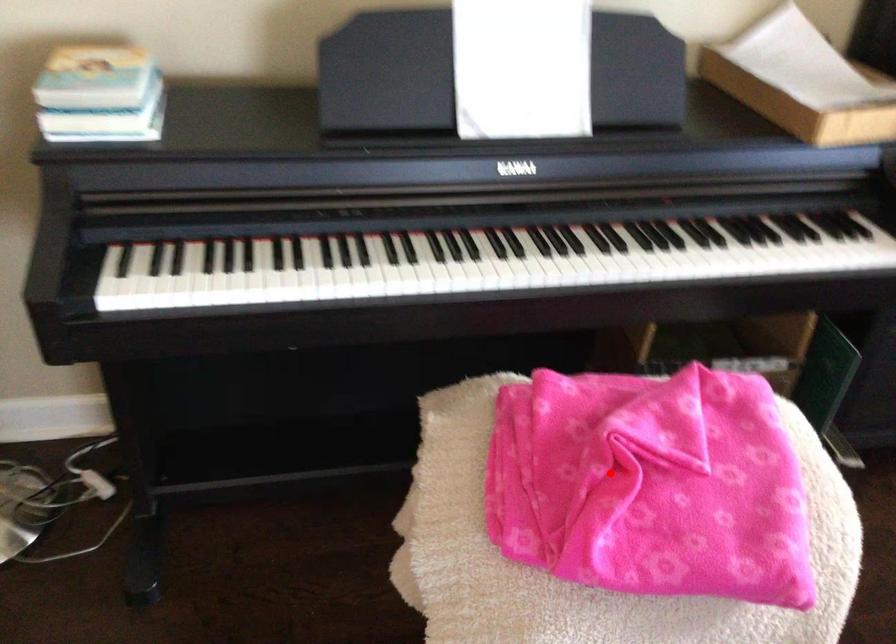
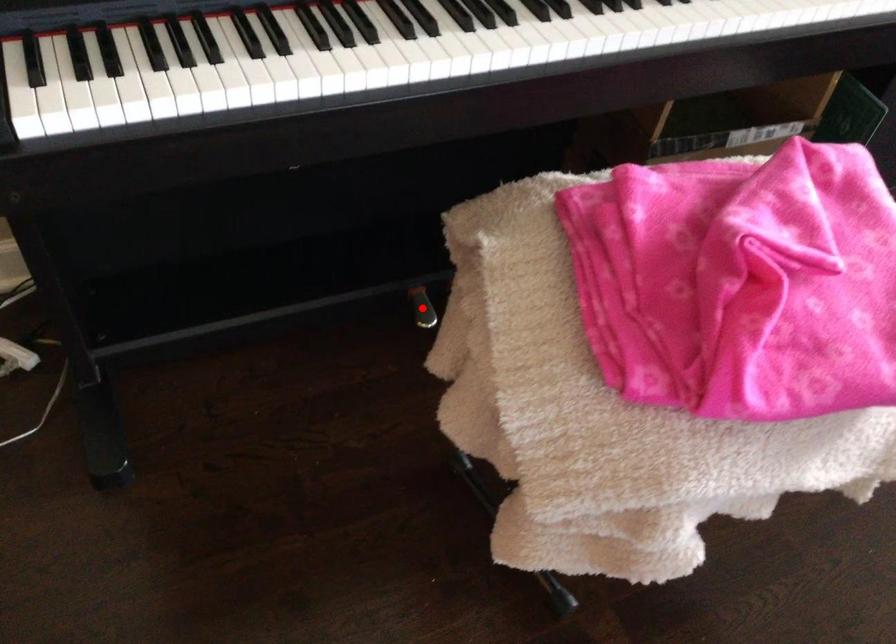
I am providing you with two images of the same scene from different viewpoints. A red point is marked on the first image and another point is marked on the second image. Is the red point in image1 aligned with the point shown in image2?

No